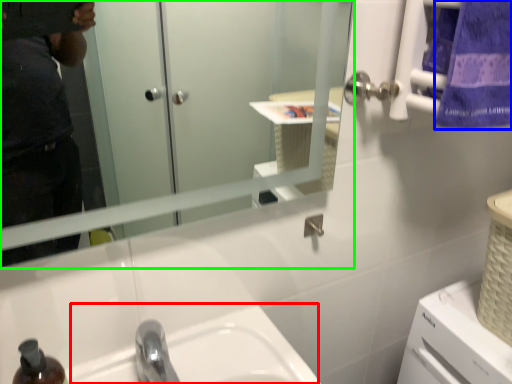
Question: Based on their relative distances, which object is nearer to sink (highlighted by a red box)? Choose from towel/napkin (highlighted by a blue box) and mirror (highlighted by a green box).

Choices:
 (A) towel/napkin
 (B) mirror

Answer: (B)